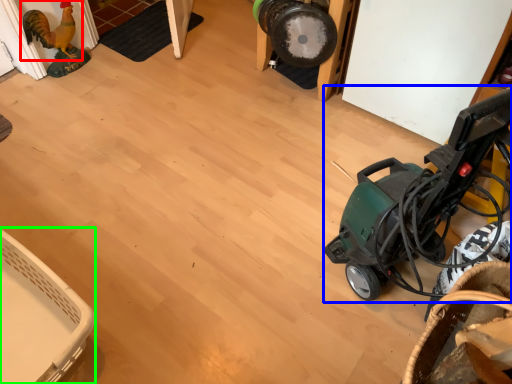
Question: Based on their relative distances, which object is nearer to chicken (highlighted by a red box)? Choose from baby carriage (highlighted by a blue box) and basket (highlighted by a green box).

Choices:
 (A) baby carriage
 (B) basket

Answer: (B)